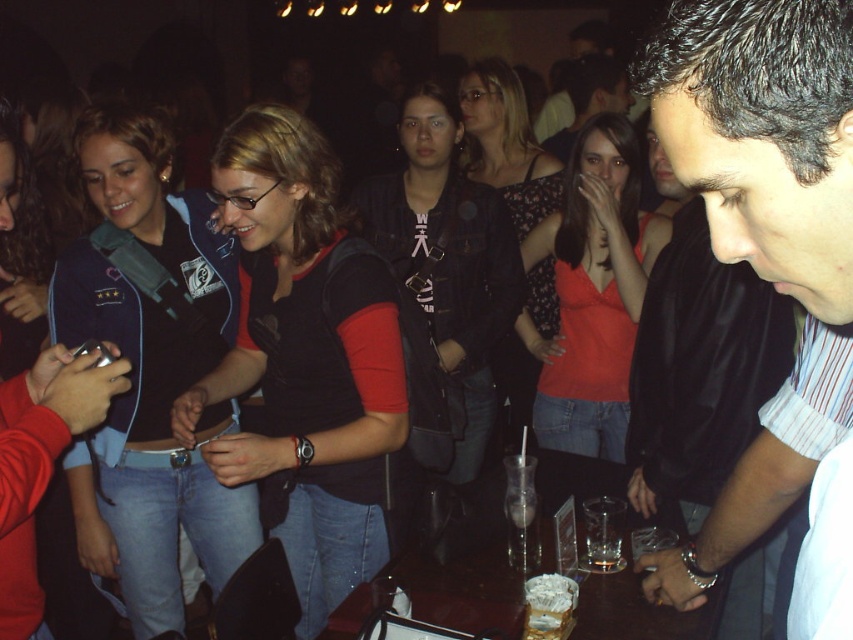
Is striped shirt at center positioned before clear glass at center?

Yes, it is.

Who is positioned more to the left, striped shirt at center or clear glass at center?

Positioned to the left is clear glass at center.

Is point (688, 560) positioned in front of point (526, 515)?

Yes, it is.

Image resolution: width=853 pixels, height=640 pixels. Identify the location of striped shirt at center. (770, 262).

Is clear glass at center wider than translucent glass cup at table center?

In fact, clear glass at center might be narrower than translucent glass cup at table center.

Who is more forward, (x=525, y=502) or (x=621, y=563)?

Point (x=621, y=563) is more forward.

Identify the location of clear glass at center. (521, 513).

Find the location of a particular element. The image size is (853, 640). striped shirt at center is located at coordinates point(770,262).

Is striped shirt at center wider than translucent glass cup at table center?

Yes, striped shirt at center is wider than translucent glass cup at table center.

Where is `striped shirt at center`? This screenshot has width=853, height=640. striped shirt at center is located at coordinates (770, 262).